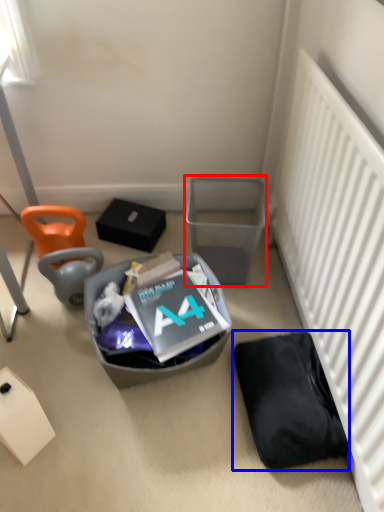
Question: Which point is further to the camera, trash bin/can (highlighted by a red box) or wide (highlighted by a blue box)?

Choices:
 (A) trash bin/can
 (B) wide

Answer: (A)